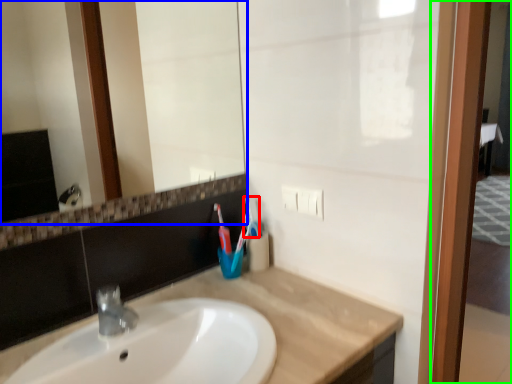
Question: Based on their relative distances, which object is nearer to toothbrush (highlighted by a red box)? Choose from mirror (highlighted by a blue box) and screen door (highlighted by a green box).

Choices:
 (A) mirror
 (B) screen door

Answer: (B)